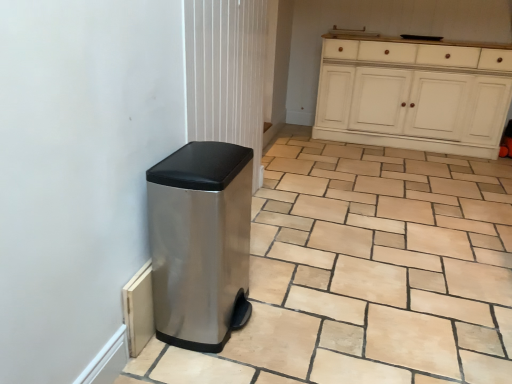
Locate an element on the screen. This screenshot has width=512, height=384. empty space that is in between white painted wood cabinet at upper right and polished stainless steel trash can at lower left is located at coordinates (349, 199).